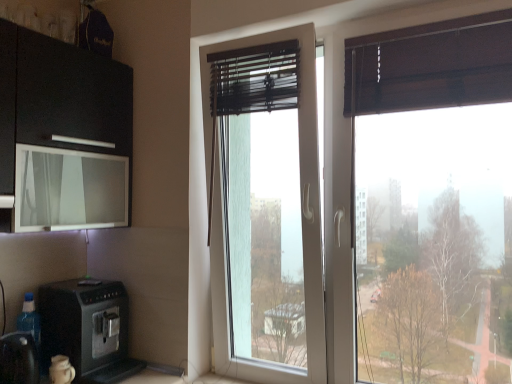
This screenshot has width=512, height=384. I want to click on transparent glass window screen at upper left, so 69,189.

Is transparent glass window at center inside the boundaries of transparent glass window screen at upper left, or outside?

transparent glass window at center is outside transparent glass window screen at upper left.

Locate an element on the screen. This screenshot has height=384, width=512. window behind the transparent glass window screen at upper left is located at coordinates (303, 228).

Which of these two, transparent glass window at center or transparent glass window screen at upper left, is wider?

With larger width is transparent glass window screen at upper left.

Based on their positions, is transparent glass window at center located to the left or right of transparent glass window screen at upper left?

Based on their positions, transparent glass window at center is located to the right of transparent glass window screen at upper left.

Does point (41, 225) come farther from viewer compared to point (229, 346)?

No, it is not.

Based on the photo, based on their sizes in the image, would you say transparent glass window screen at upper left is bigger or smaller than transparent glass window at center?

transparent glass window screen at upper left is smaller than transparent glass window at center.

Which object is wider, transparent glass window screen at upper left or transparent glass window at center?

transparent glass window screen at upper left.

From a real-world perspective, which is physically above, transparent glass window screen at upper left or transparent glass window at center?

From a 3D spatial view, transparent glass window screen at upper left is above.

The image size is (512, 384). Identify the location of home appliance located below the transparent glass window at center (from the image's perspective). (88, 329).

From a real-world perspective, is black plastic coffee machine at lower left located higher than transparent glass window at center?

No, from a real-world perspective, black plastic coffee machine at lower left is not on top of transparent glass window at center.

Which is closer to the camera, (120, 283) or (304, 178)?

Point (120, 283) appears to be farther away from the viewer than point (304, 178).

Which object is positioned more to the left, black plastic coffee machine at lower left or transparent glass window at center?

From the viewer's perspective, black plastic coffee machine at lower left appears more on the left side.

Between black plastic coffee machine at lower left and black plastic coffee machine at lower left, which one is positioned behind?

Positioned behind is black plastic coffee machine at lower left.

Is black plastic coffee machine at lower left beside black plastic coffee machine at lower left?

black plastic coffee machine at lower left and black plastic coffee machine at lower left are clearly separated.

Which of these two, black plastic coffee machine at lower left or black plastic coffee machine at lower left, stands taller?

black plastic coffee machine at lower left is taller.

From a real-world perspective, is black plastic coffee machine at lower left positioned under black plastic coffee machine at lower left based on gravity?

Yes, from a real-world perspective, black plastic coffee machine at lower left is beneath black plastic coffee machine at lower left.

Considering the positions of objects transparent glass window at center and black plastic coffee machine at lower left in the image provided, who is behind, transparent glass window at center or black plastic coffee machine at lower left?

transparent glass window at center.

Considering the sizes of transparent glass window at center and black plastic coffee machine at lower left in the image, is transparent glass window at center wider or thinner than black plastic coffee machine at lower left?

Considering their sizes, transparent glass window at center looks slimmer than black plastic coffee machine at lower left.

Considering the relative sizes of transparent glass window at center and black plastic coffee machine at lower left in the image provided, is transparent glass window at center shorter than black plastic coffee machine at lower left?

No.

Considering the relative sizes of transparent glass window at center and black plastic coffee machine at lower left in the image provided, is transparent glass window at center bigger than black plastic coffee machine at lower left?

Correct, transparent glass window at center is larger in size than black plastic coffee machine at lower left.

Which is more to the left, black plastic coffee machine at lower left or transparent glass window at center?

From the viewer's perspective, black plastic coffee machine at lower left appears more on the left side.

Is black plastic coffee machine at lower left directly adjacent to transparent glass window at center?

No, black plastic coffee machine at lower left is not touching transparent glass window at center.

Does black plastic coffee machine at lower left have a greater width compared to transparent glass window at center?

Yes, black plastic coffee machine at lower left is wider than transparent glass window at center.

From a real-world perspective, which is physically below, transparent glass window screen at upper left or black plastic coffee machine at lower left?

black plastic coffee machine at lower left, from a real-world perspective.

Locate an element on the screen. window screen above the black plastic coffee machine at lower left (from the image's perspective) is located at coordinates (69, 189).

Considering the relative positions of transparent glass window screen at upper left and black plastic coffee machine at lower left in the image provided, is transparent glass window screen at upper left to the left or to the right of black plastic coffee machine at lower left?

Clearly, transparent glass window screen at upper left is on the right of black plastic coffee machine at lower left in the image.

Is transparent glass window screen at upper left bigger than black plastic coffee machine at lower left?

Indeed, transparent glass window screen at upper left has a larger size compared to black plastic coffee machine at lower left.

Locate an element on the screen. window below the transparent glass window screen at upper left (from the image's perspective) is located at coordinates point(303,228).

Locate an element on the screen. Image resolution: width=512 pixels, height=384 pixels. window behind the transparent glass window screen at upper left is located at coordinates (303, 228).

When comparing their distances from black plastic coffee machine at lower left, does transparent glass window screen at upper left or black plastic coffee machine at lower left seem closer?

The object closer to black plastic coffee machine at lower left is black plastic coffee machine at lower left.

From the image, which object appears to be nearer to transparent glass window at center, black plastic coffee machine at lower left or black plastic coffee machine at lower left?

Among the two, black plastic coffee machine at lower left is located nearer to transparent glass window at center.

Based on their spatial positions, is transparent glass window screen at upper left or transparent glass window at center closer to black plastic coffee machine at lower left?

The object closer to black plastic coffee machine at lower left is transparent glass window screen at upper left.

Looking at the image, which one is located closer to black plastic coffee machine at lower left, transparent glass window screen at upper left or transparent glass window at center?

Based on the image, transparent glass window screen at upper left appears to be nearer to black plastic coffee machine at lower left.

When comparing their distances from transparent glass window screen at upper left, does black plastic coffee machine at lower left or transparent glass window at center seem closer?

The object closer to transparent glass window screen at upper left is black plastic coffee machine at lower left.

Which object lies nearer to the anchor point black plastic coffee machine at lower left, black plastic coffee machine at lower left or transparent glass window at center?

black plastic coffee machine at lower left lies closer to black plastic coffee machine at lower left than the other object.

From the image, which object appears to be farther from transparent glass window at center, transparent glass window screen at upper left or black plastic coffee machine at lower left?

Among the two, black plastic coffee machine at lower left is located further to transparent glass window at center.

From the image, which object appears to be farther from black plastic coffee machine at lower left, transparent glass window at center or black plastic coffee machine at lower left?

transparent glass window at center lies further to black plastic coffee machine at lower left than the other object.

Find the location of a particular element. window screen between black plastic coffee machine at lower left and transparent glass window at center from left to right is located at coordinates (69, 189).

The width and height of the screenshot is (512, 384). I want to click on home appliance between transparent glass window screen at upper left and black plastic coffee machine at lower left in the up-down direction, so click(88, 329).

What are the coordinates of `home appliance between black plastic coffee machine at lower left and transparent glass window at center` in the screenshot? It's located at (88, 329).

Image resolution: width=512 pixels, height=384 pixels. What are the coordinates of `home appliance located between transparent glass window screen at upper left and transparent glass window at center in the left-right direction` in the screenshot? It's located at (88, 329).